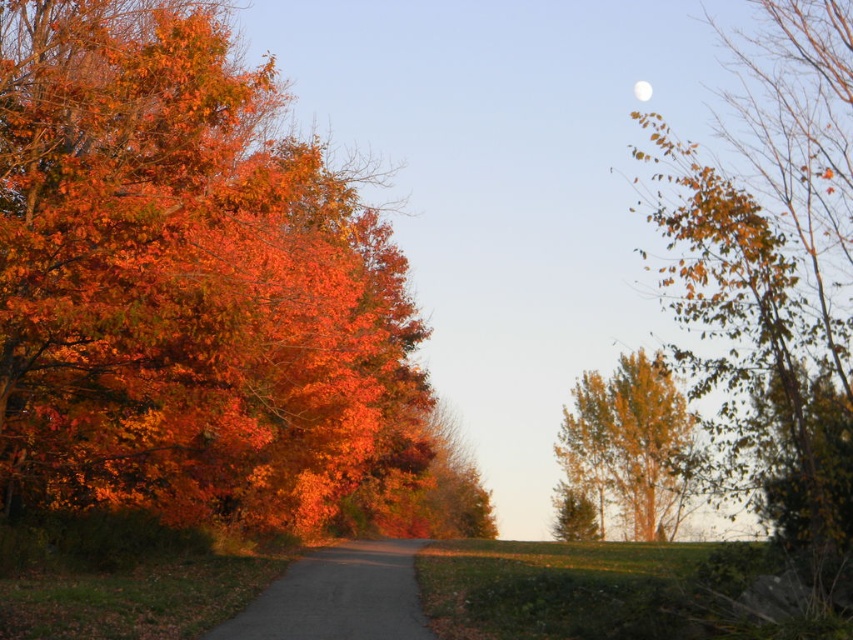
Between shiny orange leaves at left and white glossy moon at upper center, which one is positioned higher?

Positioned higher is white glossy moon at upper center.

At what (x,y) coordinates should I click in order to perform the action: click on shiny orange leaves at left. Please return your answer as a coordinate pair (x, y). The width and height of the screenshot is (853, 640). Looking at the image, I should click on (184, 282).

Locate an element on the screen. The image size is (853, 640). shiny orange leaves at left is located at coordinates (184, 282).

Who is more forward, (627, 380) or (222, 637)?

Point (222, 637) is more forward.

Which of these two, yellow/golden wood at right or dull gray asphalt road at center, stands shorter?

With less height is dull gray asphalt road at center.

Does point (621, 520) come closer to viewer compared to point (368, 576)?

No, it is behind (368, 576).

At what (x,y) coordinates should I click in order to perform the action: click on yellow/golden wood at right. Please return your answer as a coordinate pair (x, y). The image size is (853, 640). Looking at the image, I should click on (628, 444).

Can you confirm if shiny orange leaves at left is positioned to the left of yellow/golden wood at right?

Yes, shiny orange leaves at left is to the left of yellow/golden wood at right.

Can you confirm if shiny orange leaves at left is bigger than yellow/golden wood at right?

No.

What do you see at coordinates (184, 282) in the screenshot? The image size is (853, 640). I see `shiny orange leaves at left` at bounding box center [184, 282].

This screenshot has height=640, width=853. Find the location of `shiny orange leaves at left`. shiny orange leaves at left is located at coordinates (184, 282).